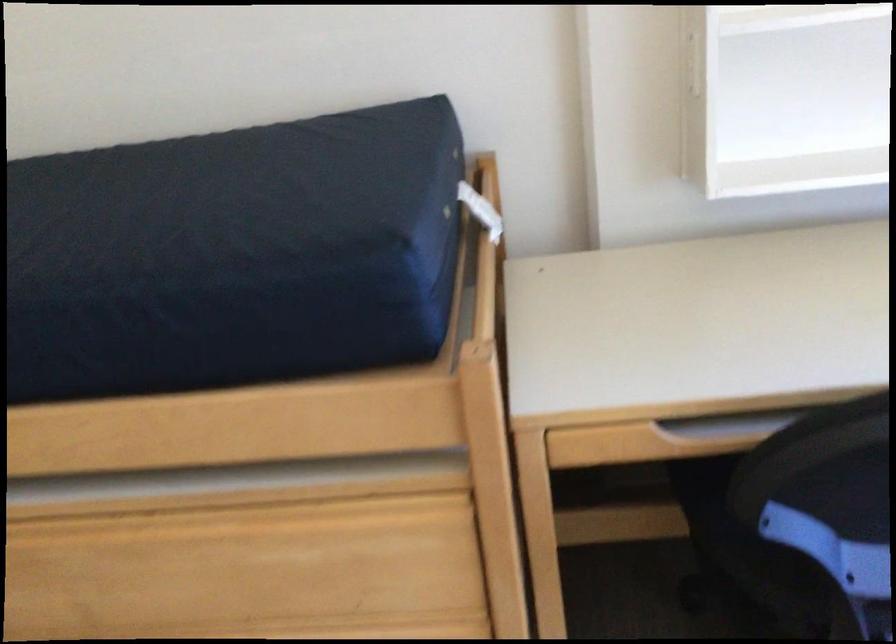
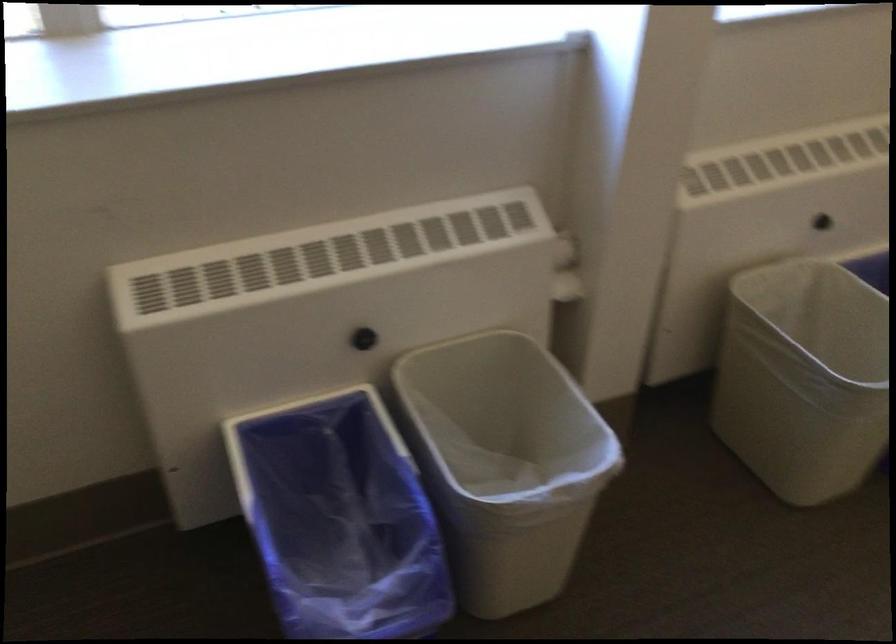
From the picture: How did the camera likely rotate?

The camera's rotation is toward right-down.